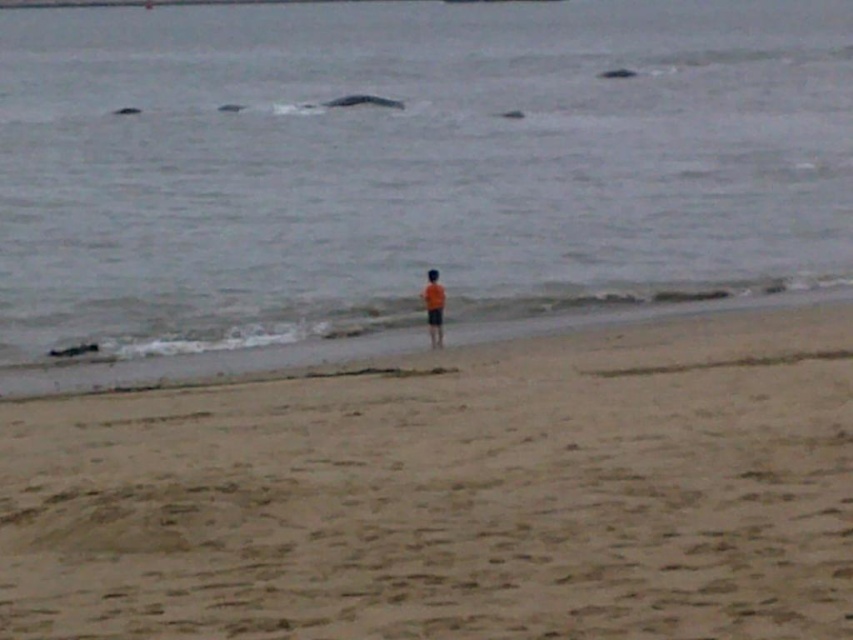
You are a photographer trying to capture the beach scene. You want to ensure that both the gray matte water at center and the light brown sand at center are clearly visible in your photo. Based on their positions, which object will appear closer to the camera in the final image?

The gray matte water at center will appear closer to the camera in the final image because the light brown sand at center is positioned behind it.